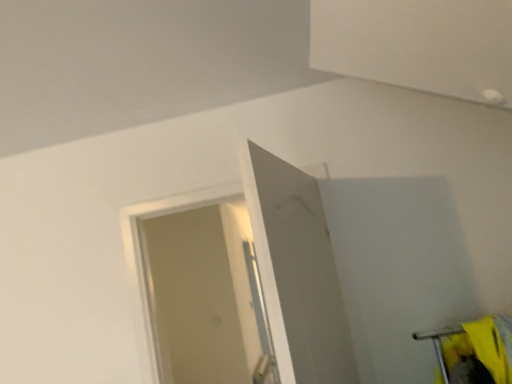
Question: Should I look upward or downward to see white matte screen door at center?

Choices:
 (A) up
 (B) down

Answer: (B)